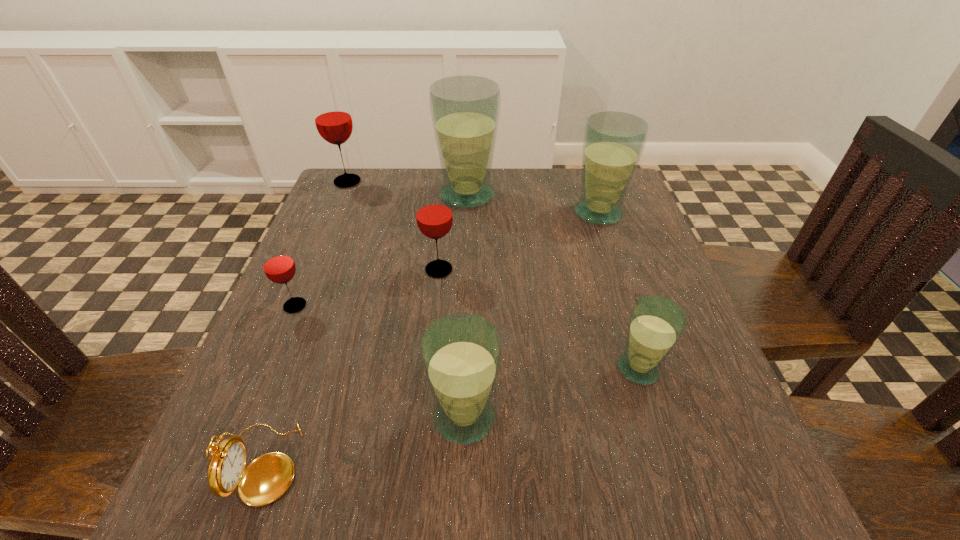
This screenshot has width=960, height=540. Identify the location of object that is the fourth closest to the third smallest blue glass. (461, 353).

Point out which glass is positioned as the third nearest to the second biggest blue glass. Please provide its 2D coordinates. Your answer should be formatted as a tuple, i.e. [(x, y)], where the tuple contains the x and y coordinates of a point satisfying the conditions above.

[(656, 323)]

This screenshot has height=540, width=960. In order to click on the closest glass to the third smallest blue glass in this screenshot , I will do `click(465, 110)`.

Where is `the third closest blue glass to the pocket watch`? The height and width of the screenshot is (540, 960). the third closest blue glass to the pocket watch is located at coordinates (465, 110).

Locate which blue glass ranks second in proximity to the shortest object. Please provide its 2D coordinates. Your answer should be formatted as a tuple, i.e. [(x, y)], where the tuple contains the x and y coordinates of a point satisfying the conditions above.

[(656, 323)]

Find the location of a particular element. The height and width of the screenshot is (540, 960). red glass that is the third closest to the third biggest blue glass is located at coordinates (332, 116).

Point out which red glass is positioned as the nearest to the second biggest blue glass. Please provide its 2D coordinates. Your answer should be formatted as a tuple, i.e. [(x, y)], where the tuple contains the x and y coordinates of a point satisfying the conditions above.

[(434, 217)]

Locate an element on the screen. free space that satisfies the following two spatial constraints: 1. on the back side of the smallest red glass; 2. on the right side of the tallest glass is located at coordinates (342, 195).

This screenshot has height=540, width=960. In order to click on free spot that satisfies the following two spatial constraints: 1. on the front side of the farthest red glass; 2. on the left side of the second smallest blue glass in this screenshot , I will do `click(249, 417)`.